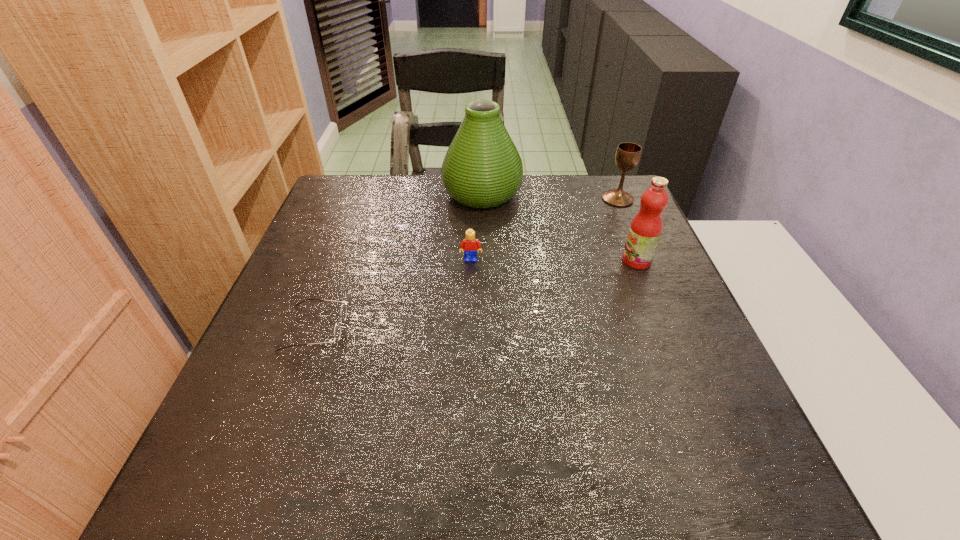
I want to click on free space between the fourth shortest object and the Lego, so tap(554, 260).

What are the coordinates of `unoccupied area between the nearest object and the vase` in the screenshot? It's located at (398, 261).

Find the location of `free point between the tallest object and the leftmost object`. free point between the tallest object and the leftmost object is located at coordinates (398, 261).

Locate an element on the screen. The width and height of the screenshot is (960, 540). free spot between the third tallest object and the Lego is located at coordinates (544, 230).

This screenshot has height=540, width=960. What are the coordinates of `object that can be found as the closest to the second tallest object` in the screenshot? It's located at (627, 156).

Identify which object is located as the nearest to the vase. Please provide its 2D coordinates. Your answer should be formatted as a tuple, i.e. [(x, y)], where the tuple contains the x and y coordinates of a point satisfying the conditions above.

[(470, 243)]

Image resolution: width=960 pixels, height=540 pixels. I want to click on vacant area in the image that satisfies the following two spatial constraints: 1. on the front-facing side of the Lego; 2. through the lenses of the spectacles, so click(469, 328).

Image resolution: width=960 pixels, height=540 pixels. I want to click on vacant point that satisfies the following two spatial constraints: 1. on the front side of the chalice; 2. on the front label of the fruit juice, so click(x=644, y=261).

You are a GUI agent. You are given a task and a screenshot of the screen. Output one action in this format:
    pyautogui.click(x=<x>, y=<y>)
    Task: Click on the free space that satisfies the following two spatial constraints: 1. on the front side of the tallest object; 2. on the left side of the third tallest object
    This screenshot has width=960, height=540.
    Given the screenshot: What is the action you would take?
    [x=482, y=199]

Find the location of a particular element. This screenshot has width=960, height=540. free location that satisfies the following two spatial constraints: 1. on the front side of the chalice; 2. on the front label of the fourth shortest object is located at coordinates (644, 261).